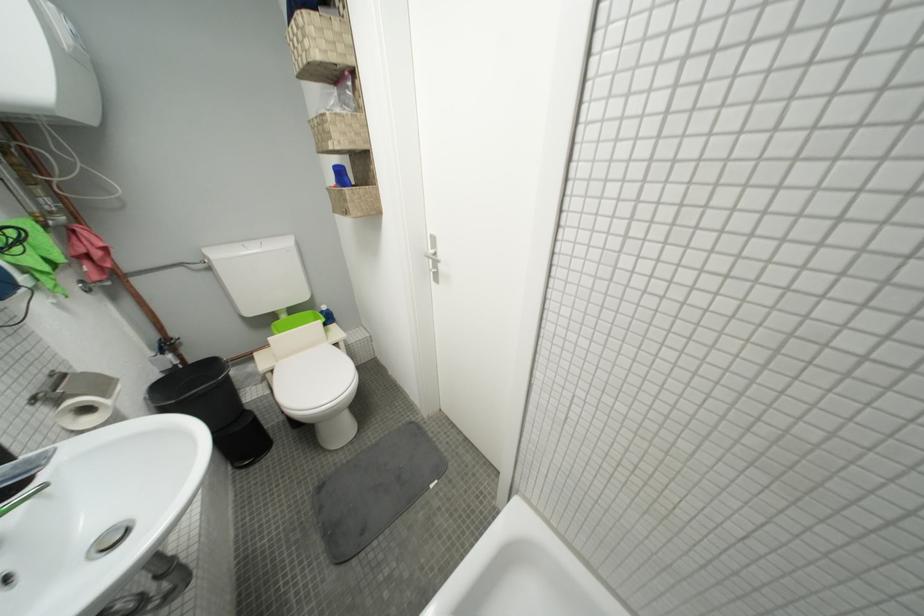
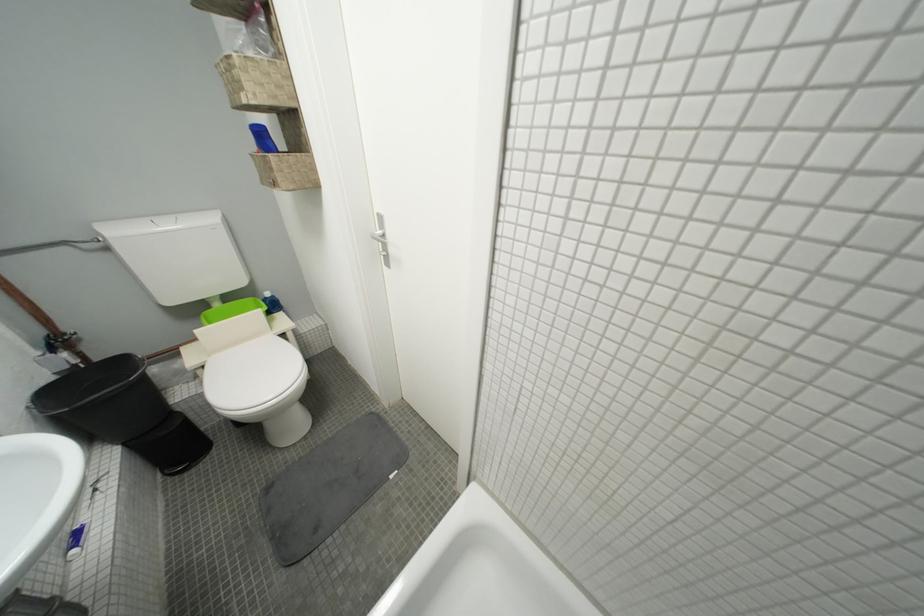
In a continuous first-person perspective shot, in which direction is the camera moving?

The movement direction of the cameraman is right, forward.